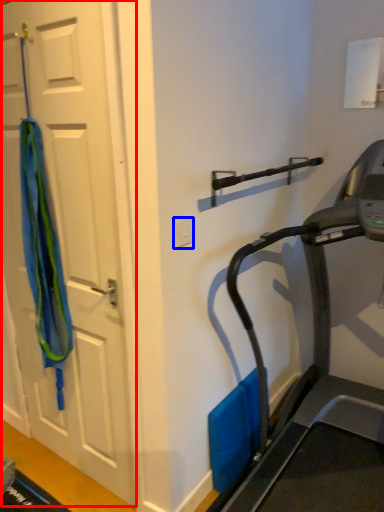
Question: Among these objects, which one is farthest to the camera, door (highlighted by a red box) or electric outlet (highlighted by a blue box)?

Choices:
 (A) door
 (B) electric outlet

Answer: (B)